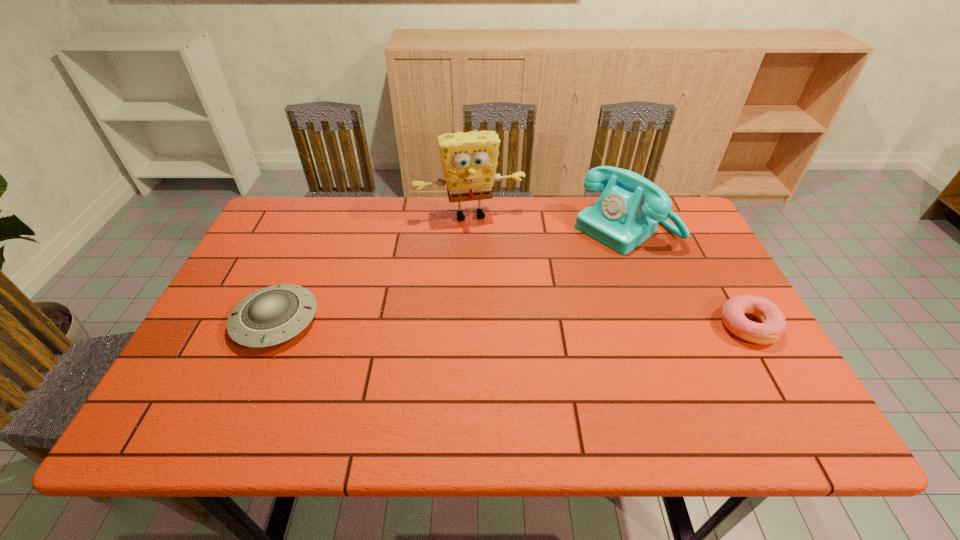
This screenshot has height=540, width=960. Find the location of `saucer`. saucer is located at coordinates (272, 315).

You are a GUI agent. You are given a task and a screenshot of the screen. Output one action in this format:
    pyautogui.click(x=<x>, y=<y>)
    Task: Click on the doughnut
    
    Given the screenshot: What is the action you would take?
    pyautogui.click(x=773, y=325)

Identify the location of the second object from left to right. (469, 160).

I want to click on sponge, so click(x=469, y=160).

Identify the location of telephone. (629, 209).

In order to click on free space located on the back of the leftmost object in this screenshot , I will do `click(320, 219)`.

This screenshot has width=960, height=540. I want to click on free location located 0.140m on the back of the doughnut, so click(715, 268).

The height and width of the screenshot is (540, 960). I want to click on vacant space situated 0.290m on the face of the sponge, so click(x=497, y=295).

Where is `free space located on the face of the sponge`? This screenshot has width=960, height=540. free space located on the face of the sponge is located at coordinates (503, 318).

Identify the location of vacant position located on the face of the sponge. This screenshot has width=960, height=540. (494, 287).